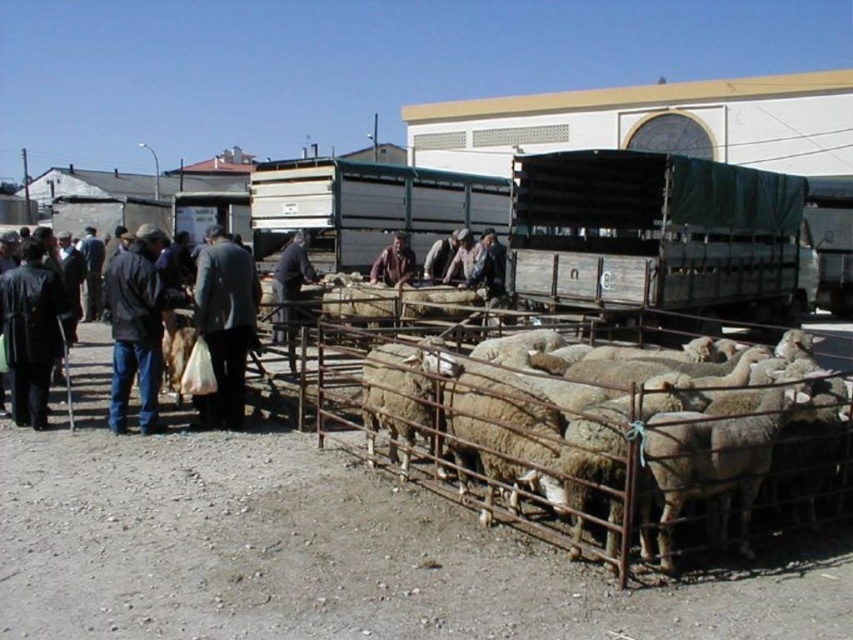
Question: Is wooden wagon at center positioned in front of dark gray suit at center?

Choices:
 (A) no
 (B) yes

Answer: (A)

Question: Is wooden wagon at center above dark blue jeans at center?

Choices:
 (A) yes
 (B) no

Answer: (A)

Question: Among these objects, which one is farthest from the camera?

Choices:
 (A) dark blue fabric at center
 (B) wooden wagon at center

Answer: (B)

Question: Which point is farther from the camera taking this photo?

Choices:
 (A) (286, 246)
 (B) (793, 314)

Answer: (A)

Question: Which of the following is the farthest from the observer?

Choices:
 (A) (552, 460)
 (B) (305, 259)

Answer: (B)

Question: Considering the relative positions of white woolen sheep at center and wooden wagon at center in the image provided, where is white woolen sheep at center located with respect to wooden wagon at center?

Choices:
 (A) left
 (B) right

Answer: (B)